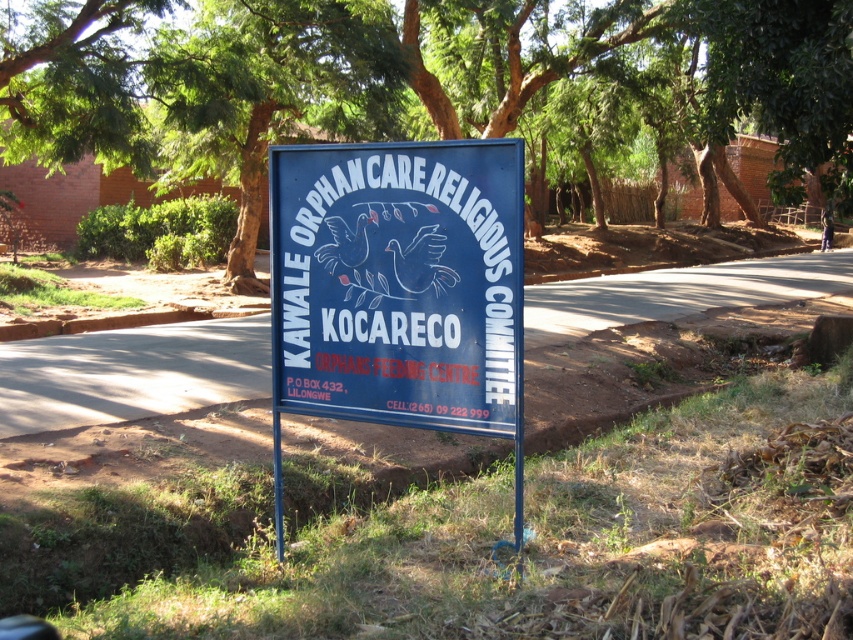
Question: Is green leafy tree at upper center to the left of blue painted metal signboard at center from the viewer's perspective?

Choices:
 (A) no
 (B) yes

Answer: (A)

Question: Is green leafy tree at upper center above blue painted metal signboard at center?

Choices:
 (A) yes
 (B) no

Answer: (A)

Question: Which point is closer to the camera taking this photo?

Choices:
 (A) (840, 3)
 (B) (289, 209)

Answer: (B)

Question: Is green leafy tree at upper center positioned in front of blue painted metal signboard at center?

Choices:
 (A) yes
 (B) no

Answer: (B)

Question: Which point is closer to the camera?

Choices:
 (A) (358, 168)
 (B) (173, 49)

Answer: (A)